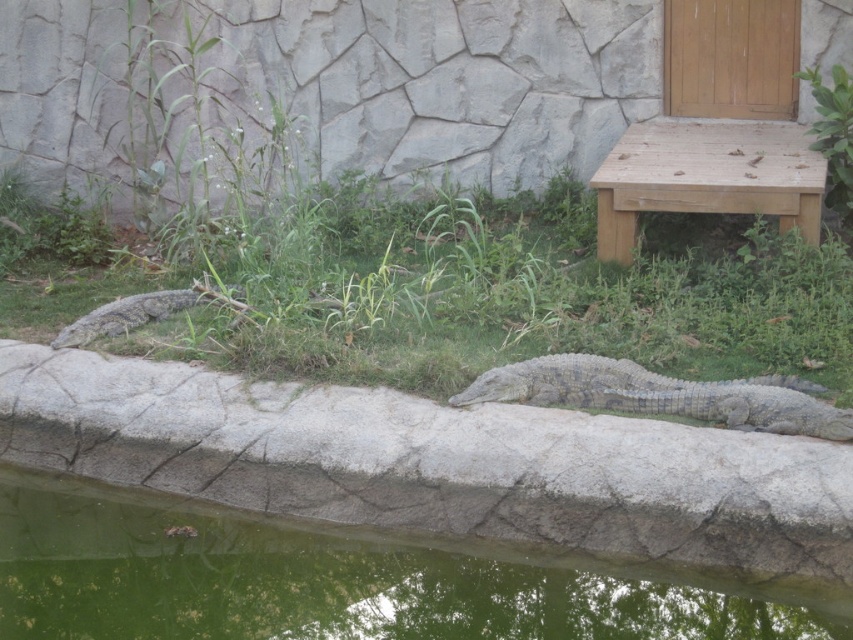
Who is positioned more to the right, green grass at center or wooden bench at upper right?

wooden bench at upper right is more to the right.

Between green grass at center and wooden bench at upper right, which one has less height?

green grass at center is shorter.

Locate an element on the screen. The height and width of the screenshot is (640, 853). green grass at center is located at coordinates (451, 292).

You are a GUI agent. You are given a task and a screenshot of the screen. Output one action in this format:
    pyautogui.click(x=<x>, y=<y>)
    Task: Click on the green grass at center
    The width and height of the screenshot is (853, 640).
    Given the screenshot: What is the action you would take?
    pyautogui.click(x=451, y=292)

This screenshot has height=640, width=853. In order to click on green grass at center in this screenshot , I will do `click(451, 292)`.

Who is more distant from viewer, (282, 248) or (833, 438)?

The point (282, 248) is more distant.

The image size is (853, 640). In order to click on green grass at center in this screenshot , I will do (x=451, y=292).

In order to click on green grass at center in this screenshot , I will do `click(451, 292)`.

Between point (207, 602) and point (170, 292), which one is positioned in front?

Point (207, 602)

Measure the distance between point (x=364, y=554) and camera.

Point (x=364, y=554) and camera are 5.59 meters apart from each other.

Find the location of a particular element. This screenshot has width=853, height=640. green water at bottom is located at coordinates (338, 580).